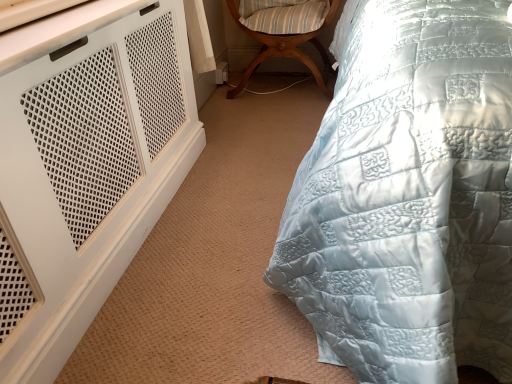
I want to click on free space on the front side of wooden striped cushioned chair at center, so 264,127.